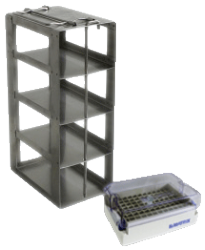
At what (x,y) coordinates should I click in order to perform the action: click on bottom shelf. Please return your answer as a coordinate pair (x, y). Looking at the image, I should click on (71, 177).